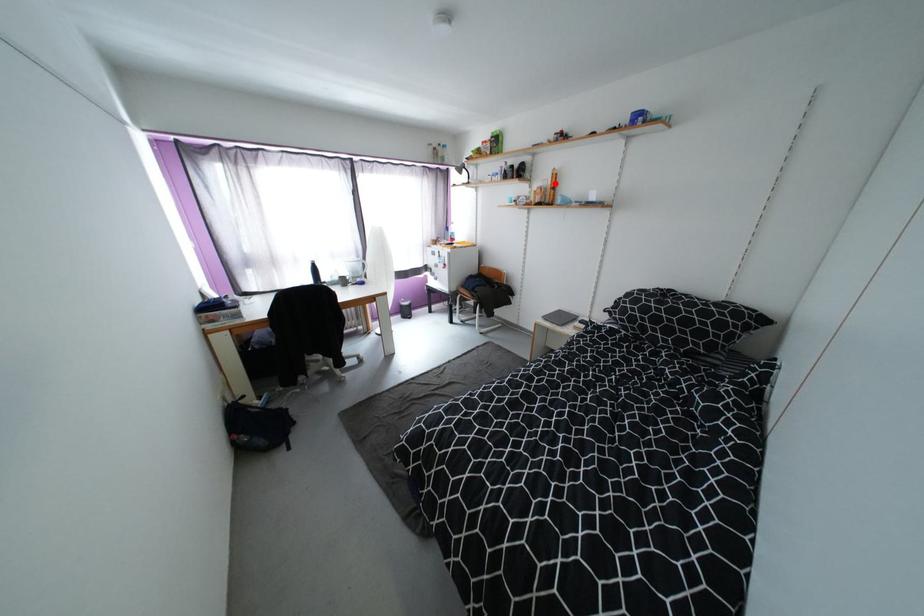
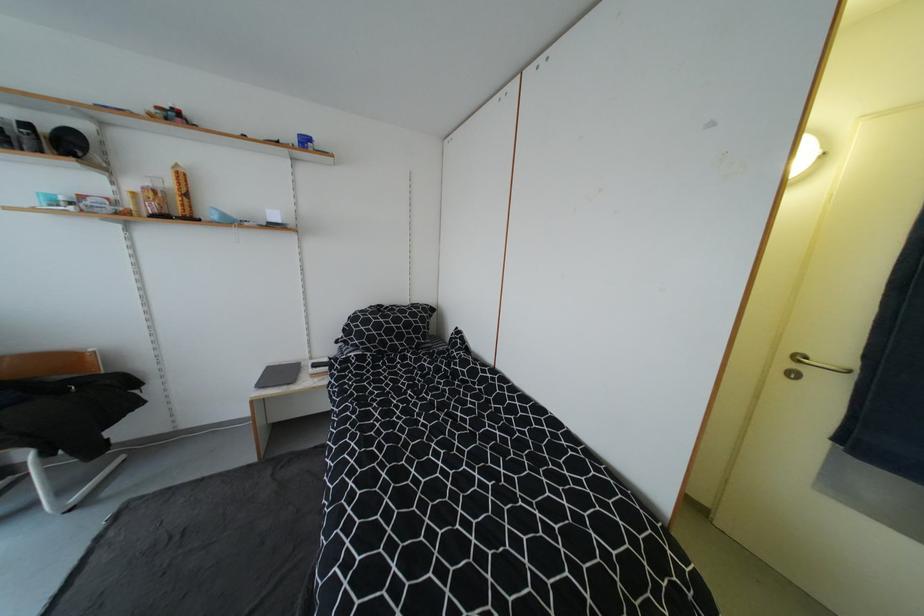
Locate, in the second image, the point that corresponds to the highlighted location in the first image.

(176, 185)